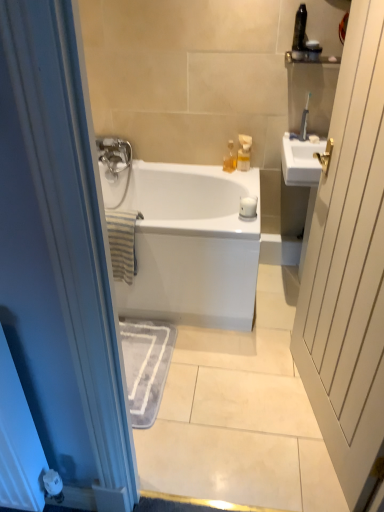
Where is `free spot to the left of translucent plastic soap dispenser at upper center, which ranks as the 4th toiletry in right-to-left order`? free spot to the left of translucent plastic soap dispenser at upper center, which ranks as the 4th toiletry in right-to-left order is located at coordinates (218, 169).